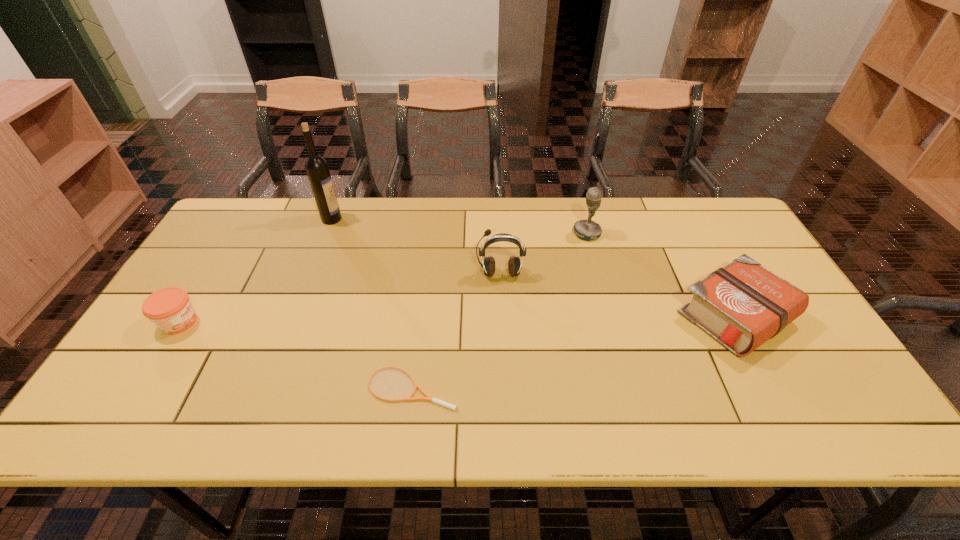
Locate an element on the screen. the tallest object is located at coordinates (316, 167).

The width and height of the screenshot is (960, 540). I want to click on the fifth object from right to left, so click(316, 167).

In order to click on microphone in this screenshot , I will do `click(587, 229)`.

Locate an element on the screen. The width and height of the screenshot is (960, 540). the fourth object from left to right is located at coordinates (514, 265).

Identify the location of Bible. coord(742,305).

At what (x,y) coordinates should I click in order to perform the action: click on the leftmost object. Please return your answer as a coordinate pair (x, y). The height and width of the screenshot is (540, 960). Looking at the image, I should click on tap(170, 309).

Identify the location of jam. (170, 309).

The width and height of the screenshot is (960, 540). Find the location of `tennis racket`. tennis racket is located at coordinates (428, 398).

Identify the location of the shortest object. This screenshot has height=540, width=960. (428, 398).

The height and width of the screenshot is (540, 960). I want to click on vacant space situated 0.380m on the label of the tallest object, so click(x=457, y=219).